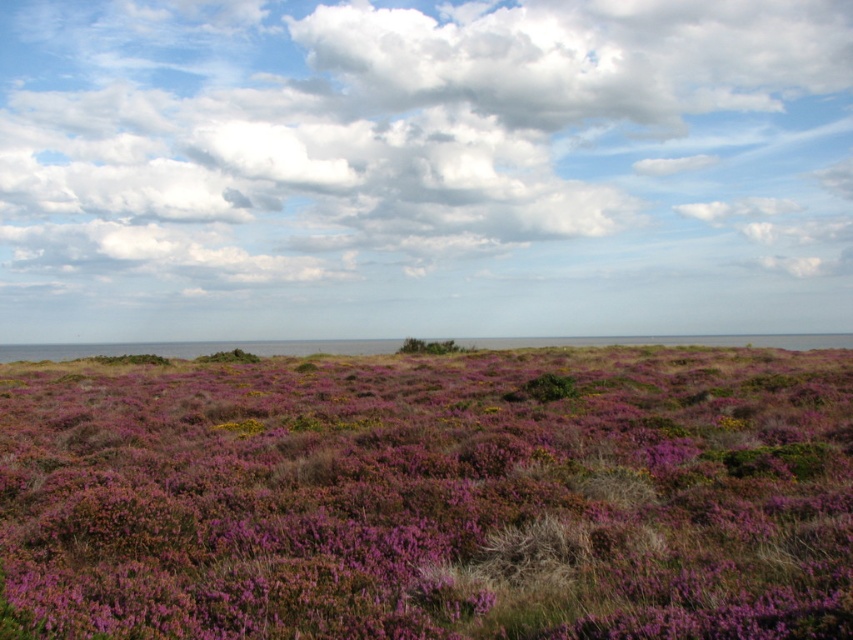
Does cloudy sky at upper center have a greater height compared to purple grass at center?

Indeed, cloudy sky at upper center has a greater height compared to purple grass at center.

Between point (71, 218) and point (491, 596), which one is positioned behind?

The point (71, 218) is more distant.

You are a GUI agent. You are given a task and a screenshot of the screen. Output one action in this format:
    pyautogui.click(x=<x>, y=<y>)
    Task: Click on the cloudy sky at upper center
    This screenshot has height=640, width=853.
    Given the screenshot: What is the action you would take?
    422,168